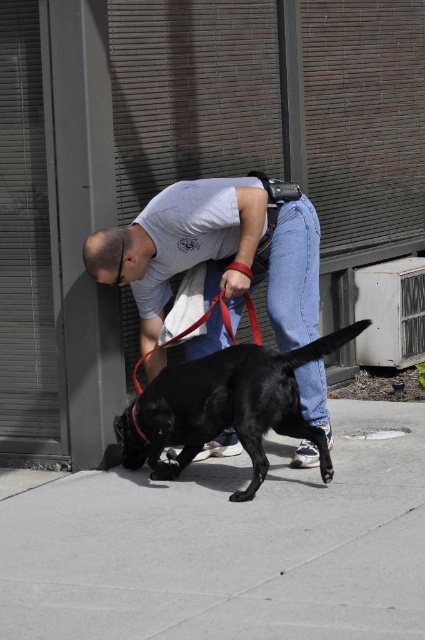
You are standing on the smooth concrete sidewalk at lower center. What are the coordinates of your current position?

The coordinates of the smooth concrete sidewalk at lower center are at point (229, 545).

You are a delivery robot that needs to navigate around the red nylon leash at lower center while staying on the smooth concrete sidewalk at lower center. Can you safely move along the sidewalk without getting tangled in the leash?

The smooth concrete sidewalk at lower center is 3.82 feet from the red nylon leash at lower center. Since the distance is sufficient, the robot can safely move along the sidewalk without getting tangled in the leash.